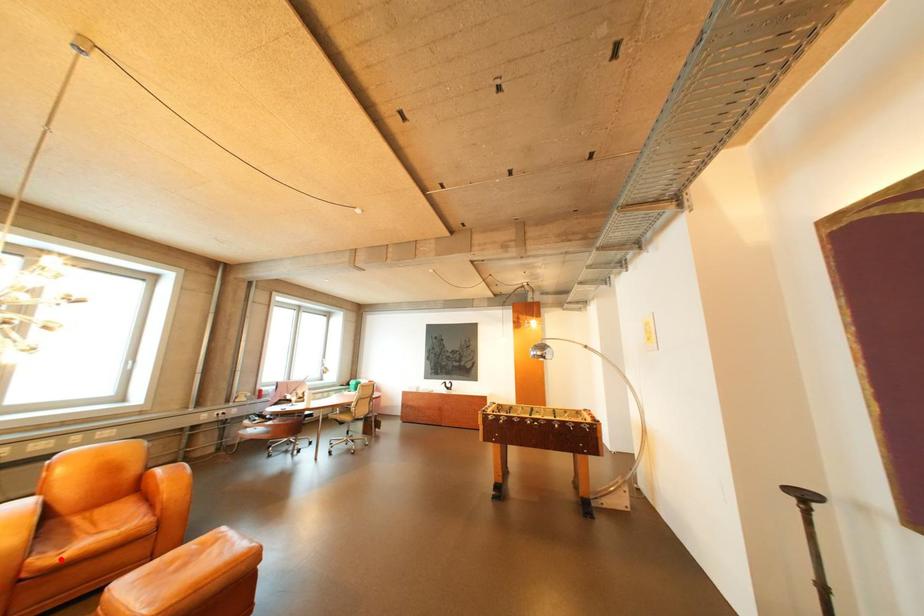
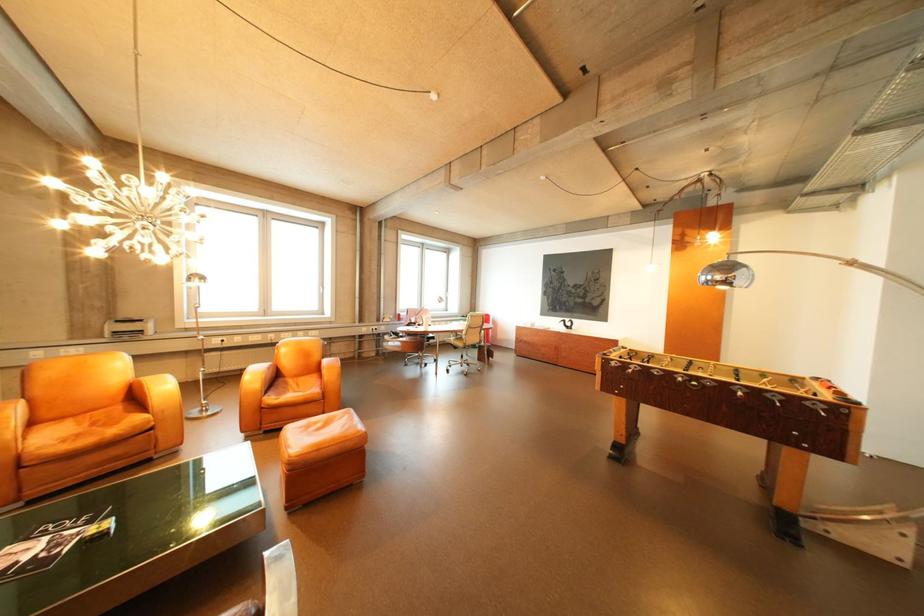
Question: I am providing you with two images of the same scene from different viewpoints. In image1, a red point is highlighted. Considering the same 3D point in image2, which of the following is correct?

Choices:
 (A) It is closer
 (B) It is farther

Answer: (B)